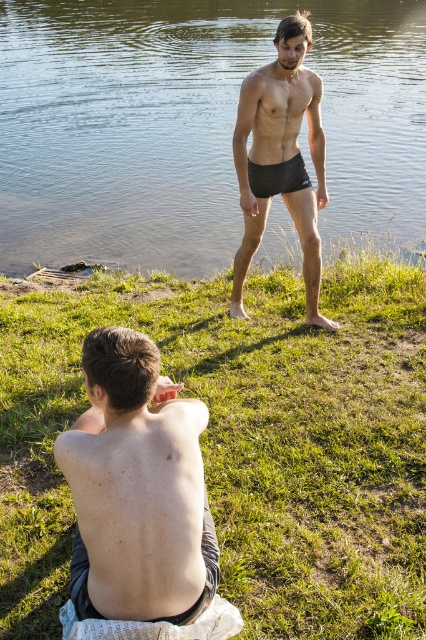
You are standing at the edge of the lake and want to locate the clear water area to swim. According to the coordinates provided, where exactly is the clear water at center located?

The clear water at center is located at coordinates point (192, 124).

From the picture: You are planning to set up a picnic blanket in the lakeside scene. The picnic blanket is 2 meters wide. You have two options for placement areas based on the objects in the image. The first option is on the green grass at center, and the second option is on the clear water at center. Which area can accommodate the picnic blanket without overlapping its edges?

The clear water at center has a larger size compared to the green grass at center, so the picnic blanket can be placed on the clear water at center without overlapping its edges.